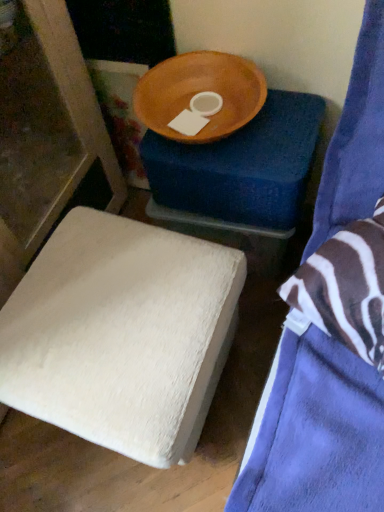
You are a GUI agent. You are given a task and a screenshot of the screen. Output one action in this format:
    pyautogui.click(x=<x>, y=<y>)
    Task: Click on the free space above white fuzzy ottoman at lower left, which is counted as the second furniture, starting from the front (from a real-world perspective)
    This screenshot has width=384, height=512.
    Given the screenshot: What is the action you would take?
    pyautogui.click(x=105, y=306)